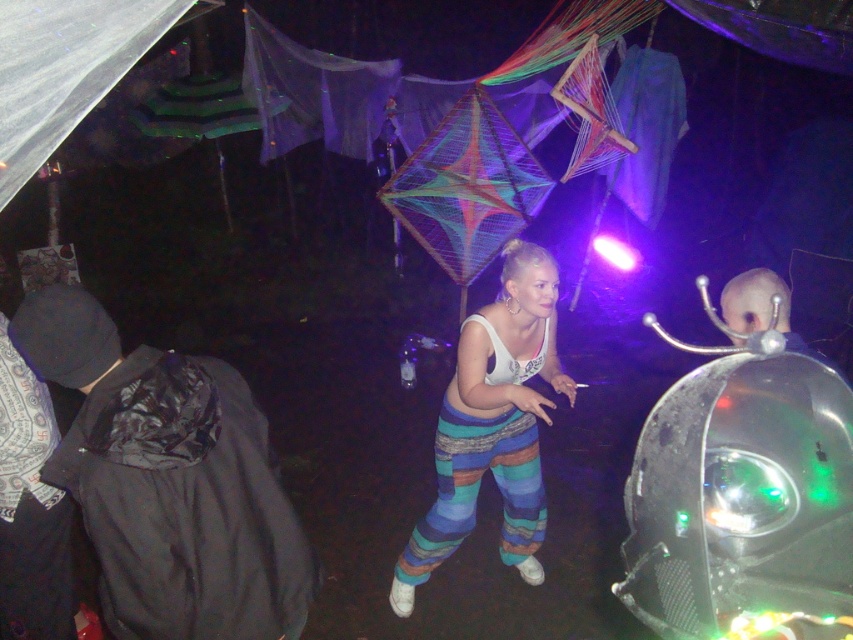
Question: Considering the relative positions of black plastic bag at lower left and white cotton tank top at center in the image provided, where is black plastic bag at lower left located with respect to white cotton tank top at center?

Choices:
 (A) above
 (B) below

Answer: (A)

Question: Is black plastic bag at lower left below white cotton tank top at center?

Choices:
 (A) yes
 (B) no

Answer: (B)

Question: Which object is closer to the camera taking this photo?

Choices:
 (A) black plastic bag at lower left
 (B) white cotton tank top at center

Answer: (A)

Question: Which of the following is the farthest from the observer?

Choices:
 (A) black plastic bag at lower left
 (B) white cotton tank top at center

Answer: (B)

Question: Can you confirm if black plastic bag at lower left is smaller than white cotton tank top at center?

Choices:
 (A) no
 (B) yes

Answer: (B)